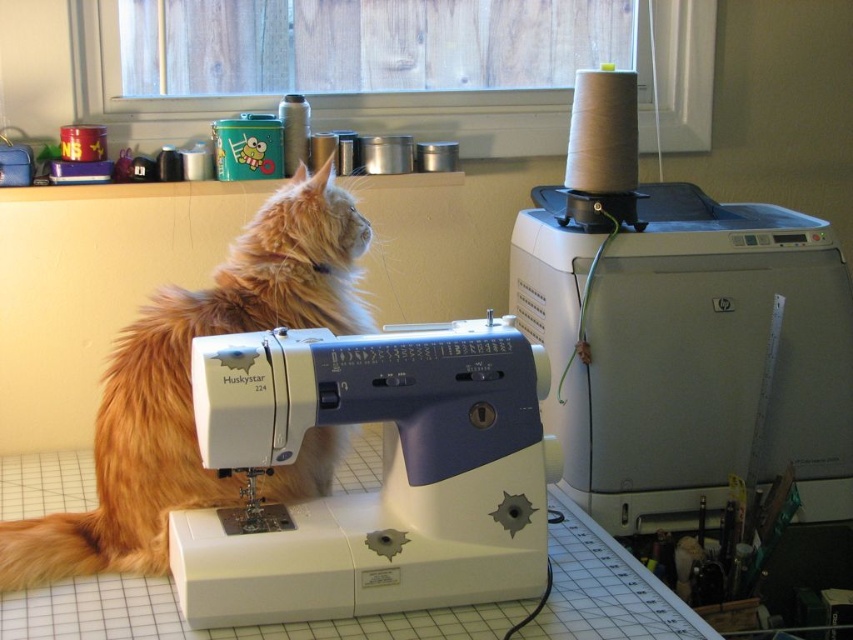
You need to place a 20 cm wide fabric piece between the white plastic sewing machine at upper right and the fluffy orange cat at left. Can you fit it there?

The white plastic sewing machine at upper right might be wider than the fluffy orange cat at left, so the space between them may be sufficient to fit a 20 cm wide fabric piece. However, without exact measurements, it is uncertain. Check the actual distance before placing the fabric.

You are standing 3 feet away from the sewing machine. Is the point at coordinates point (410, 339) closer to you than the sewing machine?

The distance of point (410, 339) from viewer is 4.00 feet. Since you are standing 3 feet away from the sewing machine, the point is farther away than the sewing machine. Therefore, the point is not closer to you than the sewing machine.